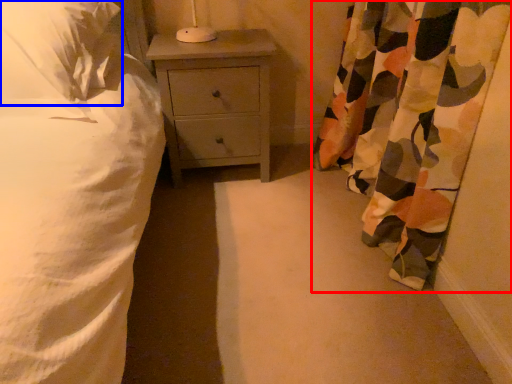
Question: Among these objects, which one is farthest to the camera, curtain (highlighted by a red box) or pillow (highlighted by a blue box)?

Choices:
 (A) curtain
 (B) pillow

Answer: (B)